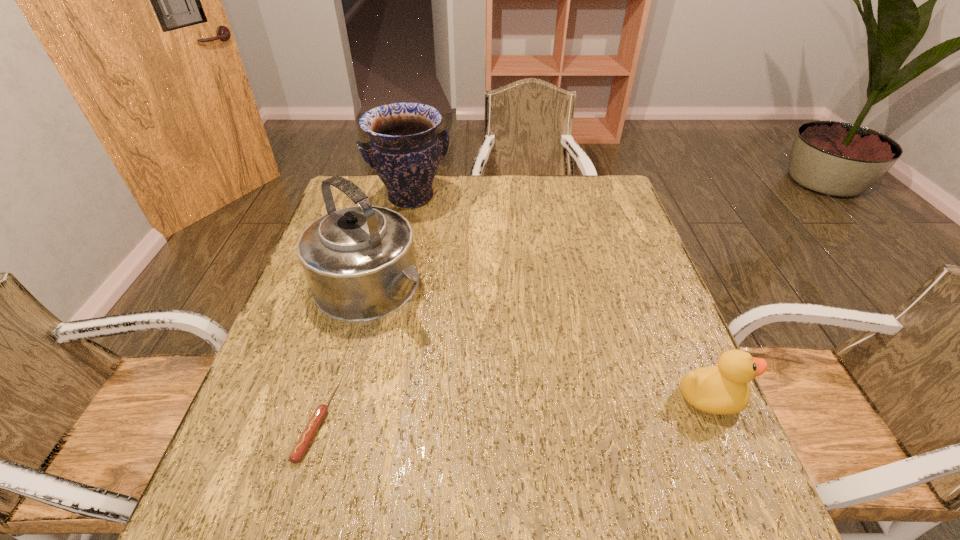
The height and width of the screenshot is (540, 960). I want to click on free space on the desktop that is between the shortest object and the second shortest object and is positioned on the front handle of the pottery, so click(525, 409).

You are a GUI agent. You are given a task and a screenshot of the screen. Output one action in this format:
    pyautogui.click(x=<x>, y=<y>)
    Task: Click on the vacant space on the desktop that is between the shortest object and the second shortest object and is positioned with the spout at the front of the second farthest object
    This screenshot has height=540, width=960.
    Given the screenshot: What is the action you would take?
    pyautogui.click(x=535, y=408)